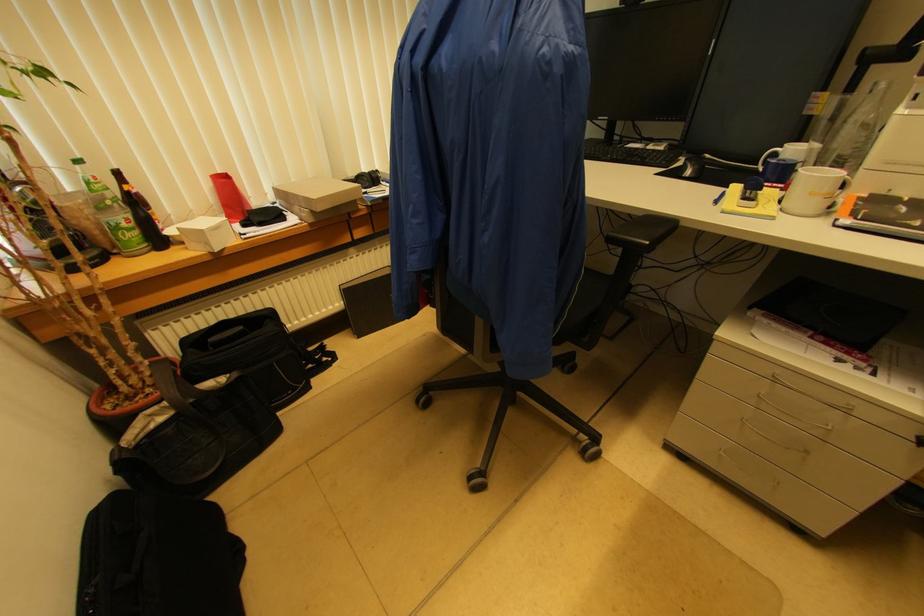
The width and height of the screenshot is (924, 616). What do you see at coordinates (719, 197) in the screenshot? I see `the blue pen` at bounding box center [719, 197].